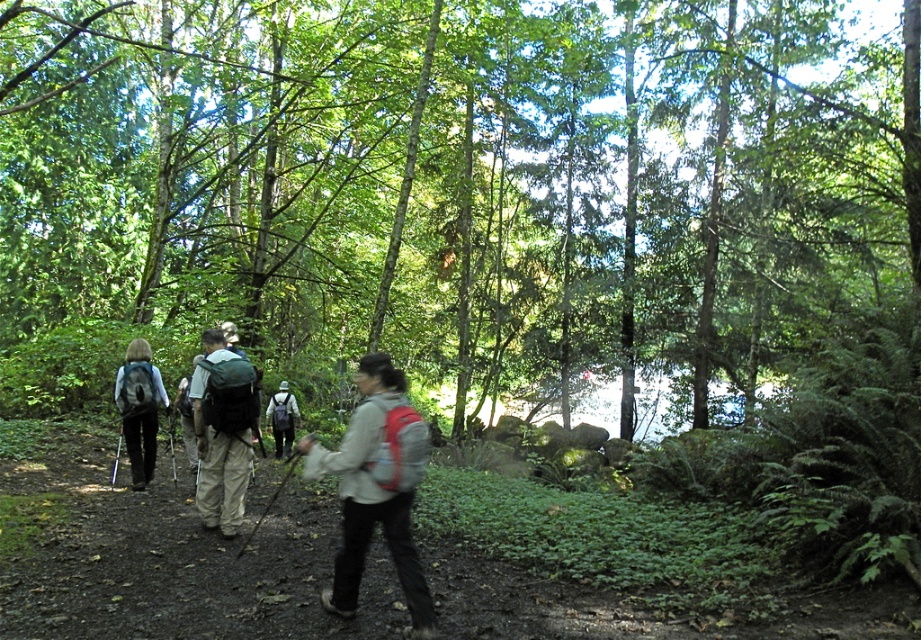
You are a hiker planning to set up a tent between the two points marked as point (442,364) and another point. The distance between these two points is 31.33 meters. If your tent requires a space of 10 meters by 10 meters, will there be enough space between them to set it up?

The distance between the two points is 31.33 meters, which is more than enough to accommodate a 10x10 meter tent space. Therefore, there is sufficient space between them to set up the tent.

You are a hiker trying to determine the position of the two matte gray backpacks in the forest. Which one is nearer to you, the matte gray backpack at left or the matte gray backpack at center?

The matte gray backpack at left is closer to the viewer than the matte gray backpack at center.

In the scene shown: You are a hiker planning to carry both the matte gray backpack at left and the matte gray backpack at center. Which backpack has a taller height?

The matte gray backpack at left has a greater height compared to the matte gray backpack at center.